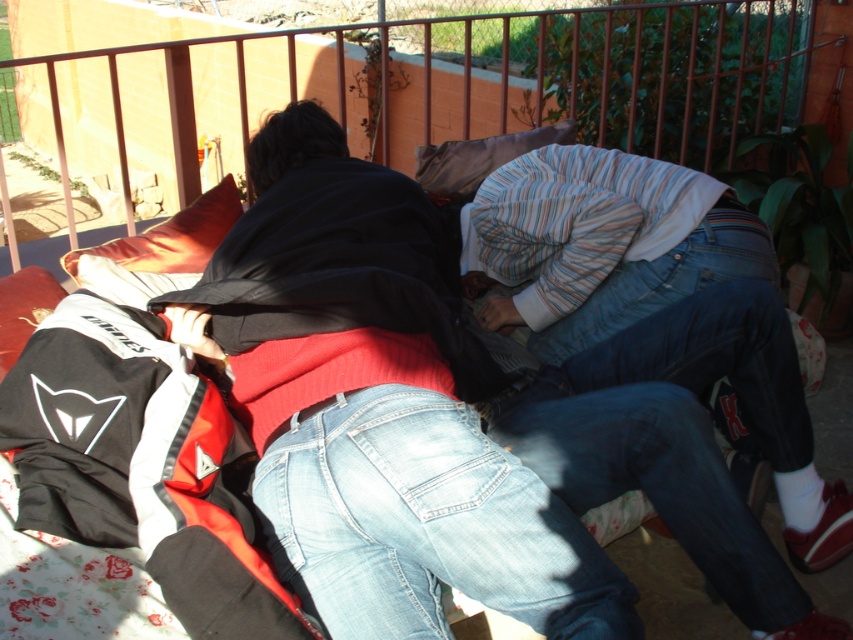
Between light blue denim jeans at center and jeans at lower right, which one has more height?

jeans at lower right is taller.

Can you confirm if light blue denim jeans at center is positioned to the right of jeans at lower right?

No, light blue denim jeans at center is not to the right of jeans at lower right.

Identify the location of light blue denim jeans at center. This screenshot has width=853, height=640. (426, 524).

Is jeans at lower right bigger than orange fabric pillow at upper left?

Yes.

Is jeans at lower right above orange fabric pillow at upper left?

No.

Does point (572, 451) come farther from viewer compared to point (167, 259)?

No.

Locate an element on the screen. The width and height of the screenshot is (853, 640). jeans at lower right is located at coordinates (654, 481).

Between point (283, 465) and point (566, 122), which one is positioned in front?

Point (283, 465) is more forward.

Image resolution: width=853 pixels, height=640 pixels. I want to click on denim jeans at center, so click(379, 406).

The height and width of the screenshot is (640, 853). In order to click on denim jeans at center in this screenshot , I will do `click(379, 406)`.